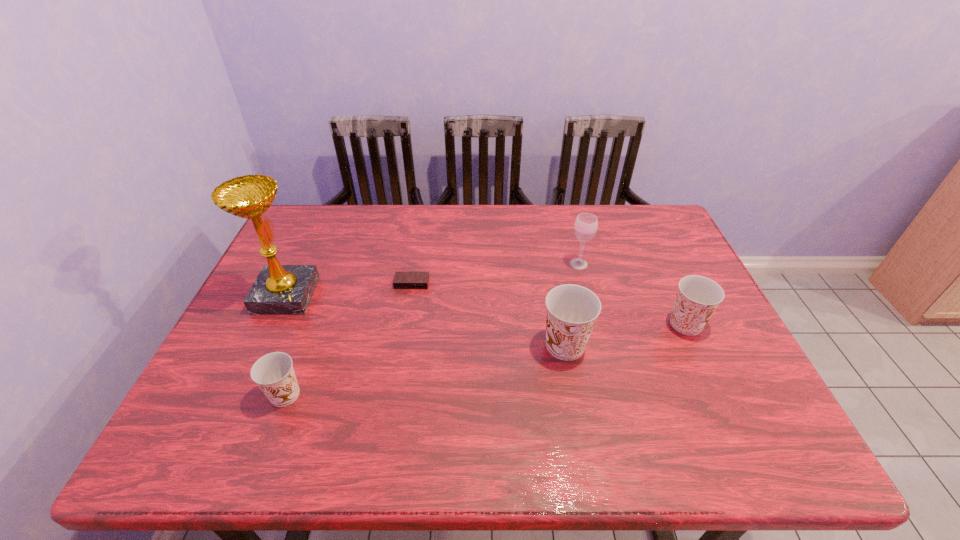
This screenshot has width=960, height=540. In order to click on the leftmost Dixie cup in this screenshot , I will do `click(274, 374)`.

The image size is (960, 540). Identify the location of the nearest Dixie cup. (274, 374).

The height and width of the screenshot is (540, 960). In order to click on the second Dixie cup from right to left in this screenshot , I will do `click(572, 310)`.

Where is `the rightmost Dixie cup`? the rightmost Dixie cup is located at coordinates (697, 298).

At what (x,y) coordinates should I click in order to perform the action: click on the rightmost object. Please return your answer as a coordinate pair (x, y). Looking at the image, I should click on (697, 298).

Find the location of `the farthest object`. the farthest object is located at coordinates (585, 227).

The width and height of the screenshot is (960, 540). Identify the location of the shortest object. (402, 280).

Locate an element on the screen. The width and height of the screenshot is (960, 540). the fourth object from right to left is located at coordinates (402, 280).

At what (x,y) coordinates should I click in order to perform the action: click on the tallest object. Please return your answer as a coordinate pair (x, y). The height and width of the screenshot is (540, 960). Looking at the image, I should click on (279, 289).

Locate an element on the screen. The width and height of the screenshot is (960, 540). vacant space located on the left of the leftmost Dixie cup is located at coordinates (200, 395).